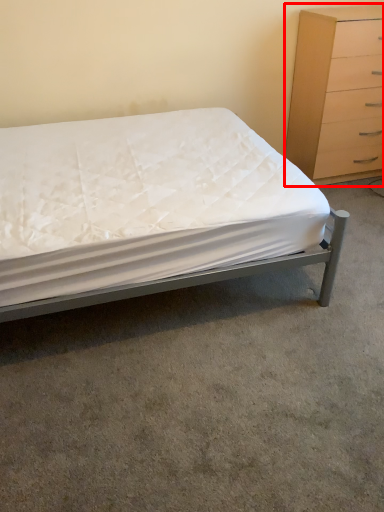
Question: Where is chest of drawers (annotated by the red box) located in relation to bed in the image?

Choices:
 (A) right
 (B) left

Answer: (A)